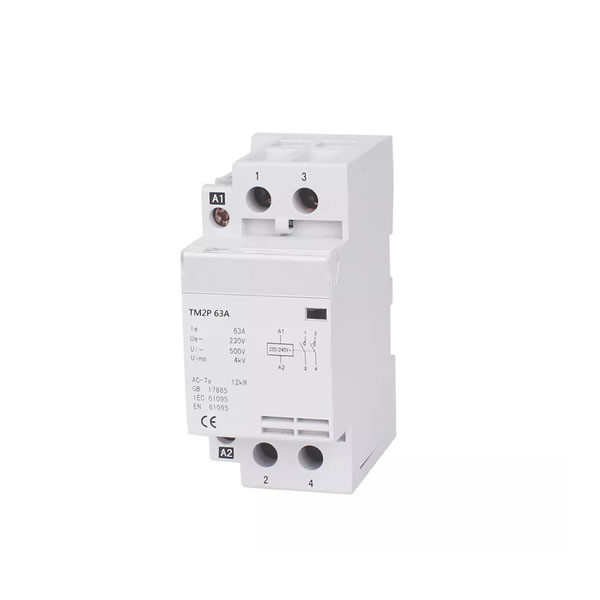
The width and height of the screenshot is (600, 600). What are the coordinates of `screws` in the screenshot? It's located at (220, 215), (261, 196), (308, 197), (272, 448), (314, 450).